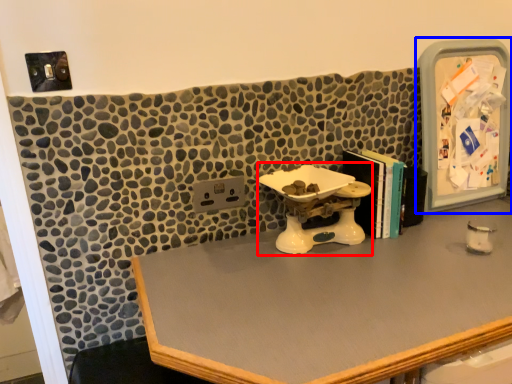
Question: Which point is further to the camera, sink (highlighted by a red box) or medicine cabinet (highlighted by a blue box)?

Choices:
 (A) sink
 (B) medicine cabinet

Answer: (B)